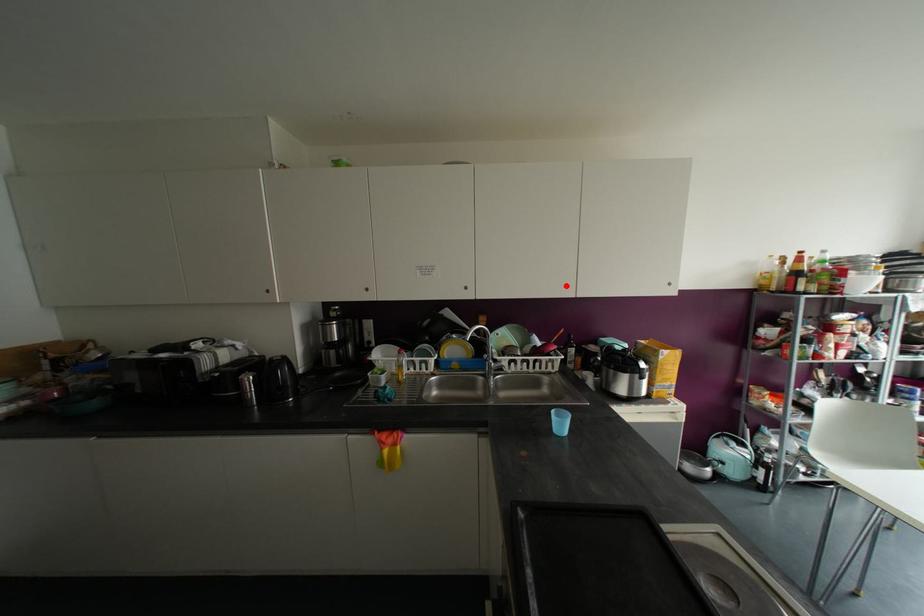
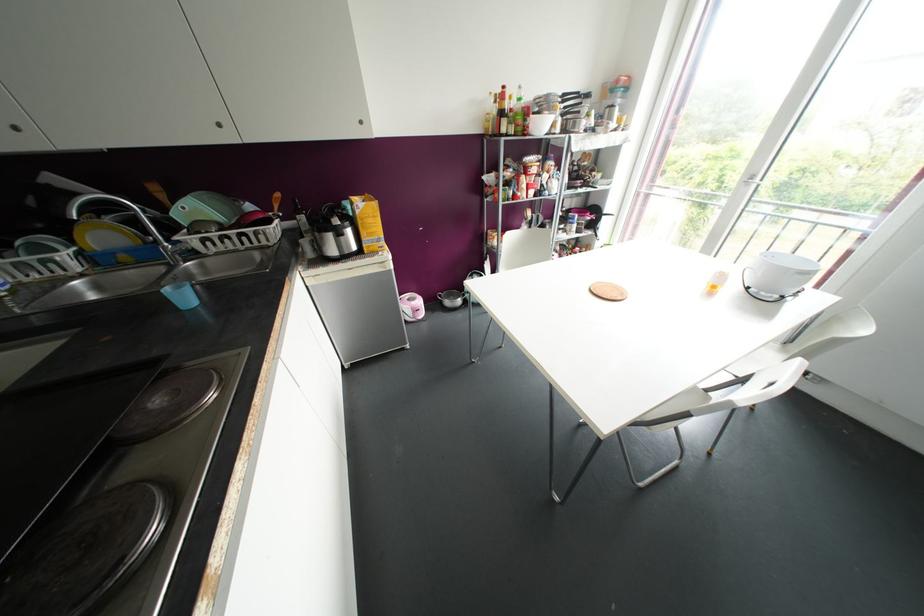
Where in the second image is the point corresponding to the highlighted location from the first image?

(219, 124)